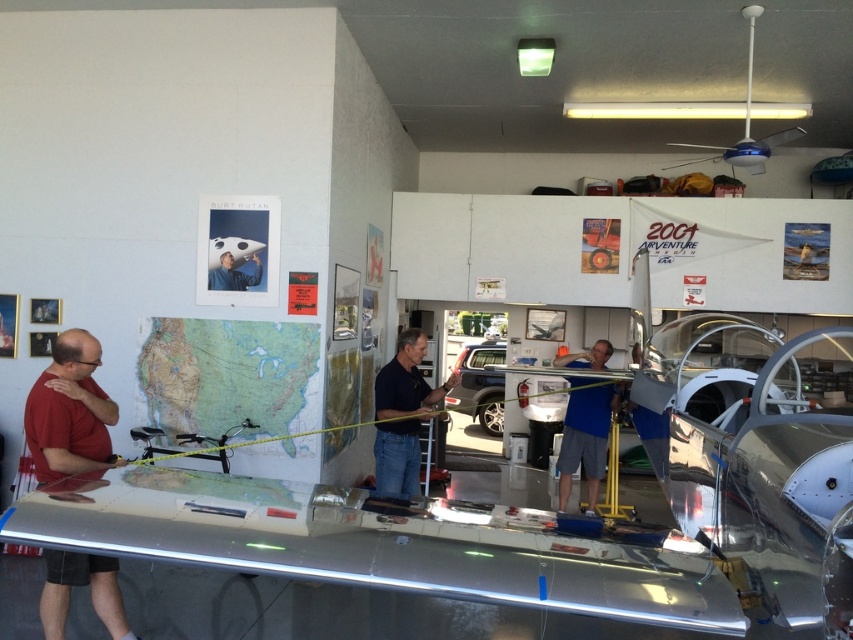
Between point (78, 429) and point (235, 282), which one is positioned in front?

Point (78, 429)

Who is shorter, red matte shirt at left or matte black airplane at center?

matte black airplane at center

Describe the element at coordinates (68, 412) in the screenshot. I see `red matte shirt at left` at that location.

At what (x,y) coordinates should I click in order to perform the action: click on red matte shirt at left. Please return your answer as a coordinate pair (x, y). Looking at the image, I should click on (68, 412).

Between red matte shirt at left and black matte shirt at center, which one has less height?

With less height is red matte shirt at left.

Can you confirm if red matte shirt at left is shorter than black matte shirt at center?

Yes, red matte shirt at left is shorter than black matte shirt at center.

Where is `red matte shirt at left`? The height and width of the screenshot is (640, 853). red matte shirt at left is located at coordinates (68, 412).

Find the location of a particular element. red matte shirt at left is located at coordinates (68, 412).

How much distance is there between black matte shirt at center and blue fabric shirt at center?

black matte shirt at center and blue fabric shirt at center are 6.24 feet apart from each other.

Does black matte shirt at center appear under blue fabric shirt at center?

No.

I want to click on black matte shirt at center, so click(x=402, y=416).